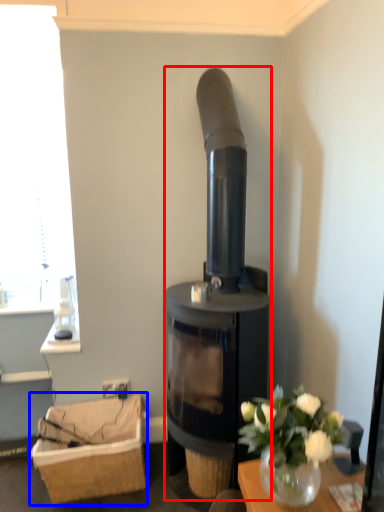
Question: Which object appears closest to the camera in this image, wood burning stove (highlighted by a red box) or basket (highlighted by a blue box)?

Choices:
 (A) wood burning stove
 (B) basket

Answer: (A)